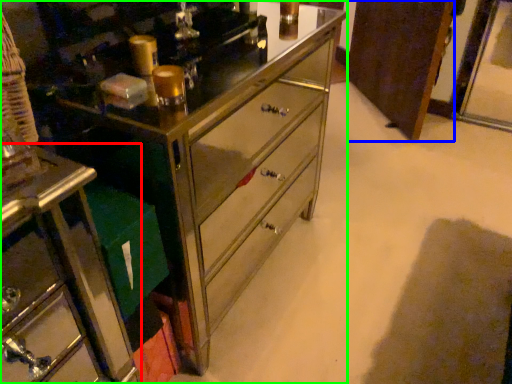
Question: Based on their relative distances, which object is nearer to furniture (highlighted by a red box)? Choose from cabinetry (highlighted by a blue box) and chest of drawers (highlighted by a green box).

Choices:
 (A) cabinetry
 (B) chest of drawers

Answer: (B)